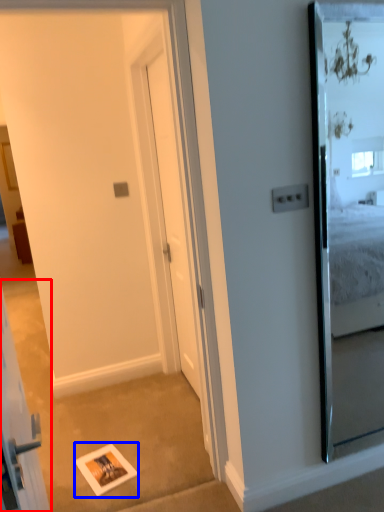
Question: Which object is closer to the camera taking this photo, elevator (highlighted by a red box) or picture frame (highlighted by a blue box)?

Choices:
 (A) elevator
 (B) picture frame

Answer: (A)